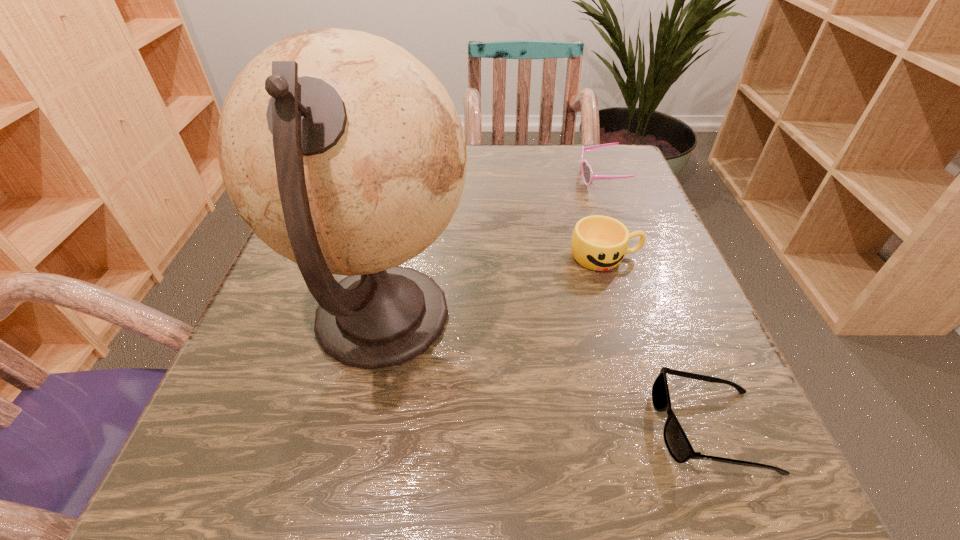
What are the coordinates of `free spot located 0.090m on the front-facing side of the farther sunglasses` in the screenshot? It's located at (540, 178).

Find the location of `free spot located 0.170m on the front-facing side of the shortest object`. free spot located 0.170m on the front-facing side of the shortest object is located at coordinates (527, 428).

Identify the location of free location located 0.140m on the front-facing side of the shortest object. (550, 428).

The height and width of the screenshot is (540, 960). I want to click on vacant space located 0.110m on the front-facing side of the shortest object, so click(x=573, y=428).

Locate an element on the screen. object located at the far edge is located at coordinates (587, 173).

Find the location of `object situated at the near edge`. object situated at the near edge is located at coordinates (677, 443).

The image size is (960, 540). What are the coordinates of `object at the left edge` in the screenshot? It's located at (342, 152).

Where is `cup that is at the right edge`? The width and height of the screenshot is (960, 540). cup that is at the right edge is located at coordinates (599, 243).

You are a GUI agent. You are given a task and a screenshot of the screen. Output one action in this format:
    pyautogui.click(x=<x>, y=<y>)
    Task: Click on the object that is positioned at the far right corner
    
    Given the screenshot: What is the action you would take?
    pyautogui.click(x=587, y=173)

Image resolution: width=960 pixels, height=540 pixels. Find the location of `object present at the near right corner`. object present at the near right corner is located at coordinates (677, 443).